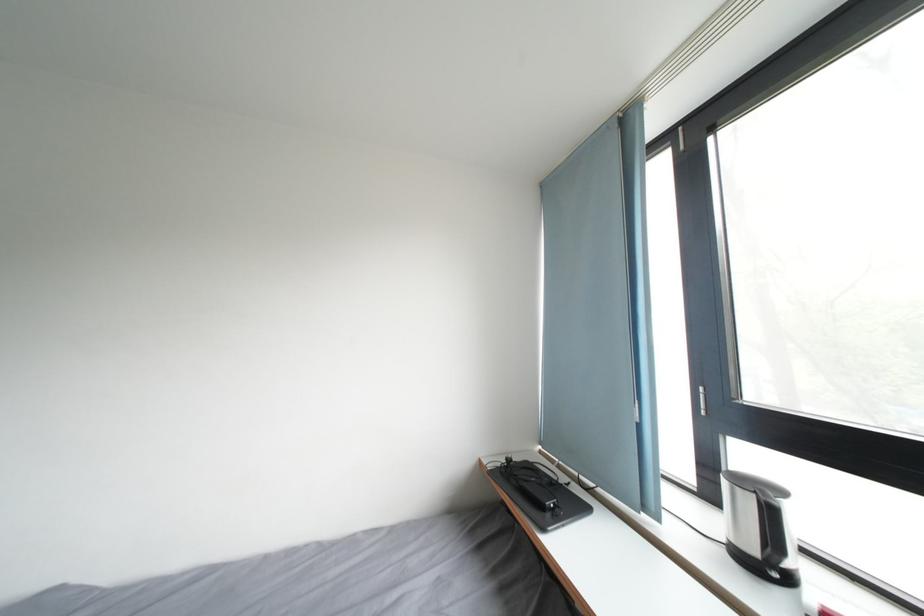
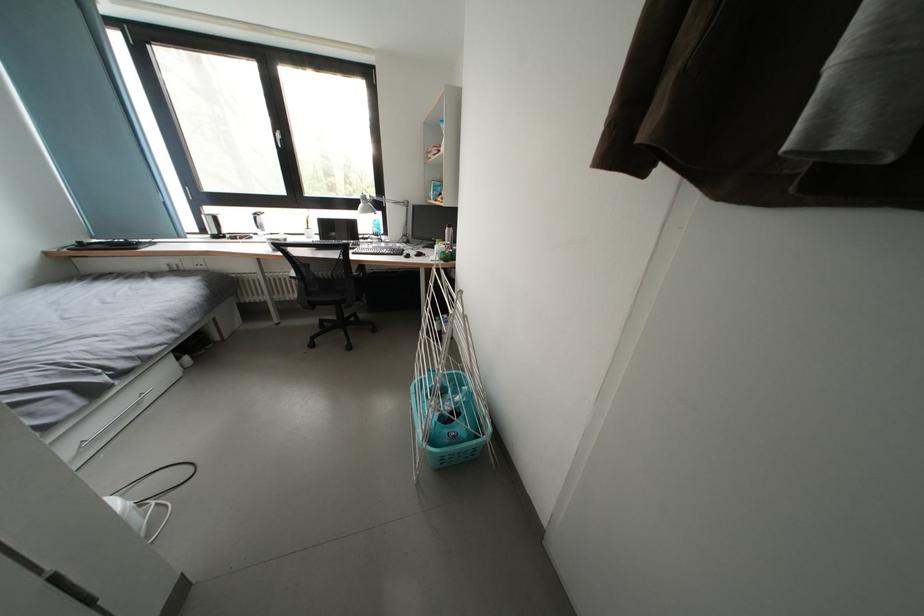
Locate, in the second image, the point that corresponds to point 776,517 in the first image.

(223, 223)